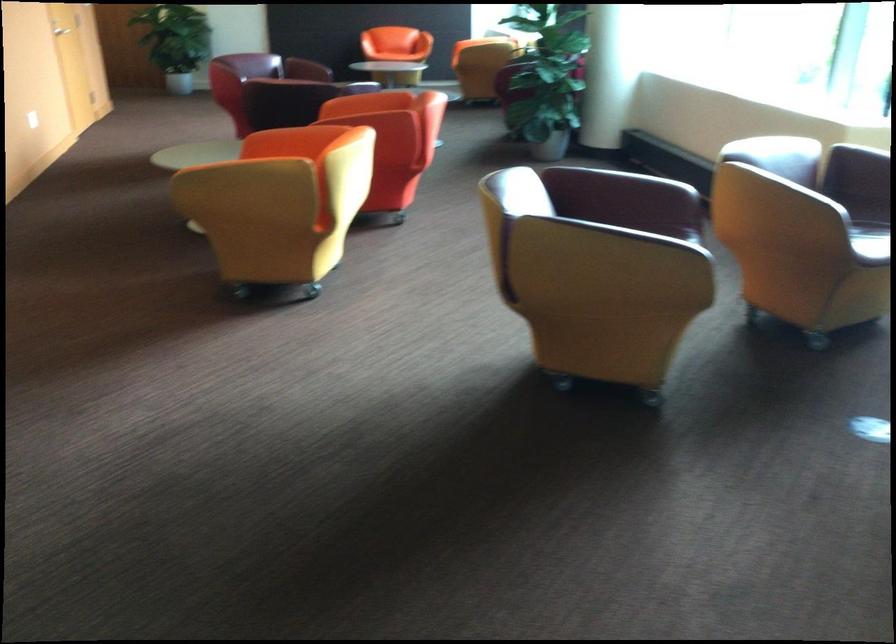
Locate an element on the screen. Image resolution: width=896 pixels, height=644 pixels. orange chair sitting surface is located at coordinates (401, 55).